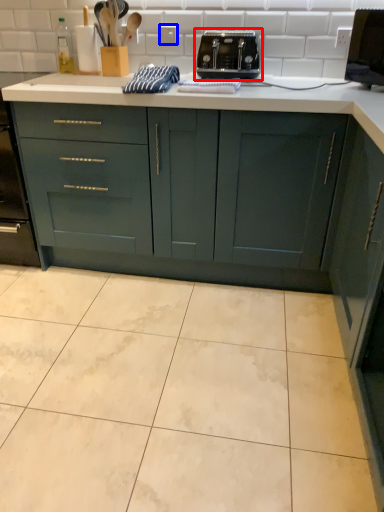
Question: Which object appears farthest to the camera in this image, toaster (highlighted by a red box) or electric outlet (highlighted by a blue box)?

Choices:
 (A) toaster
 (B) electric outlet

Answer: (B)